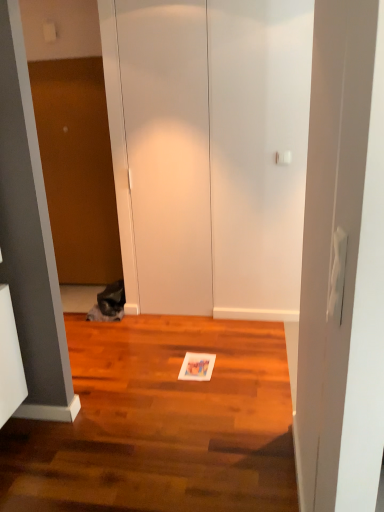
Question: Is fuzzy gray cat at left smaller than white matte door at center?

Choices:
 (A) no
 (B) yes

Answer: (B)

Question: Does fuzzy gray cat at left have a lesser height compared to white matte door at center?

Choices:
 (A) no
 (B) yes

Answer: (B)

Question: Is fuzzy gray cat at left closer to camera compared to white matte door at center?

Choices:
 (A) no
 (B) yes

Answer: (A)

Question: Is fuzzy gray cat at left directly adjacent to white matte door at center?

Choices:
 (A) no
 (B) yes

Answer: (A)

Question: From the image's perspective, is fuzzy gray cat at left on top of white matte door at center?

Choices:
 (A) no
 (B) yes

Answer: (A)

Question: In terms of width, does fuzzy gray cat at left look wider or thinner when compared to brown matte door at left?

Choices:
 (A) wide
 (B) thin

Answer: (A)

Question: Do you think fuzzy gray cat at left is within brown matte door at left, or outside of it?

Choices:
 (A) outside
 (B) inside

Answer: (A)

Question: In terms of height, does fuzzy gray cat at left look taller or shorter compared to brown matte door at left?

Choices:
 (A) tall
 (B) short

Answer: (B)

Question: Based on their positions, is fuzzy gray cat at left located to the left or right of brown matte door at left?

Choices:
 (A) right
 (B) left

Answer: (A)

Question: From the image's perspective, is shiny brown hardwood floor at center positioned above or below brown matte door at left?

Choices:
 (A) above
 (B) below

Answer: (B)

Question: In terms of height, does shiny brown hardwood floor at center look taller or shorter compared to brown matte door at left?

Choices:
 (A) short
 (B) tall

Answer: (A)

Question: Is point (281, 463) closer or farther from the camera than point (82, 204)?

Choices:
 (A) closer
 (B) farther

Answer: (A)

Question: Is shiny brown hardwood floor at center inside the boundaries of brown matte door at left, or outside?

Choices:
 (A) inside
 (B) outside

Answer: (B)

Question: Is fuzzy gray cat at left inside or outside of white matte door at center?

Choices:
 (A) outside
 (B) inside

Answer: (A)

Question: From their relative heights in the image, would you say fuzzy gray cat at left is taller or shorter than white matte door at center?

Choices:
 (A) short
 (B) tall

Answer: (A)